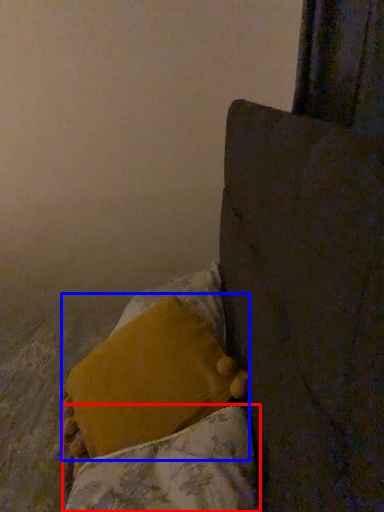
Question: Which point is closer to the camera, blanket (highlighted by a red box) or pillow (highlighted by a blue box)?

Choices:
 (A) blanket
 (B) pillow

Answer: (A)